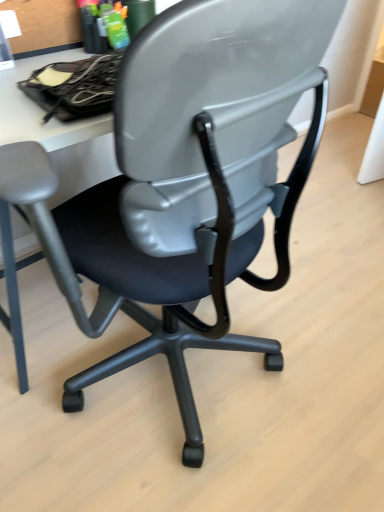
In order to face matte black bag at upper left, should I rotate leftwards or rightwards?

To face it directly, rotate left by 13.843 degrees.

Identify the location of matte black bag at upper left. [42, 110].

What do you see at coordinates (42, 110) in the screenshot? The image size is (384, 512). I see `matte black bag at upper left` at bounding box center [42, 110].

At what (x,y) coordinates should I click in order to perform the action: click on matte black bag at upper left. Please return your answer as a coordinate pair (x, y). The width and height of the screenshot is (384, 512). Looking at the image, I should click on (42, 110).